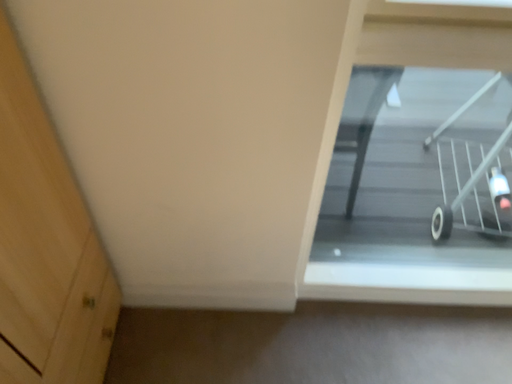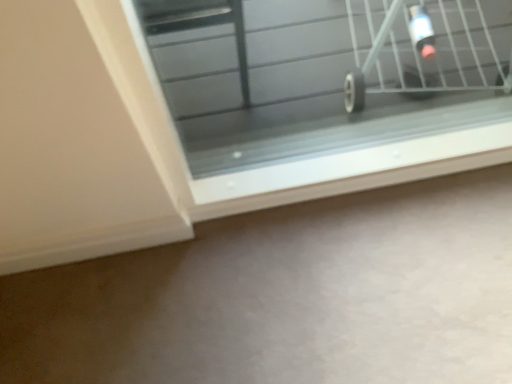
Question: Which way did the camera rotate in the video?

Choices:
 (A) rotated downward
 (B) rotated upward

Answer: (A)